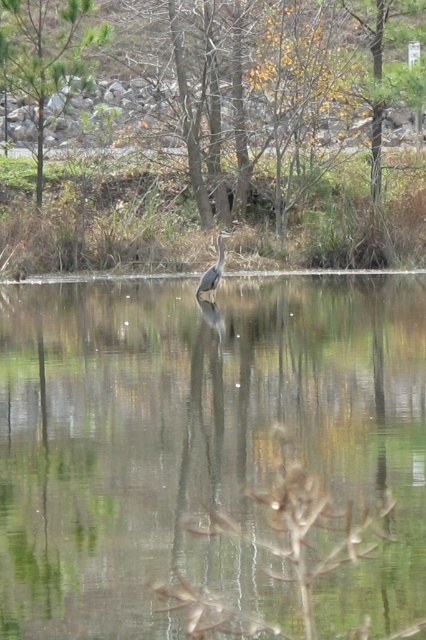
The width and height of the screenshot is (426, 640). I want to click on green matte tree at upper left, so click(46, 54).

Find the location of a particular element. The height and width of the screenshot is (640, 426). green matte tree at upper left is located at coordinates (46, 54).

Is brown textured tree at upper center taller than green matte tree at upper left?

Incorrect, brown textured tree at upper center's height is not larger of green matte tree at upper left's.

Who is taller, brown textured tree at upper center or green matte tree at upper left?

With more height is green matte tree at upper left.

Which is in front, point (140, 6) or point (37, 193)?

Point (37, 193)

What are the coordinates of `brown textured tree at upper center` in the screenshot? It's located at (239, 80).

Is point (230, 406) farther from viewer compared to point (91, 35)?

No, it is not.

How distant is clear water at center from green matte tree at upper left?

They are 7.25 meters apart.

At what (x,y) coordinates should I click in order to perform the action: click on clear water at center. Please return your answer as a coordinate pair (x, y). This screenshot has width=426, height=640. Looking at the image, I should click on (201, 444).

Identify the location of clear water at center. (201, 444).